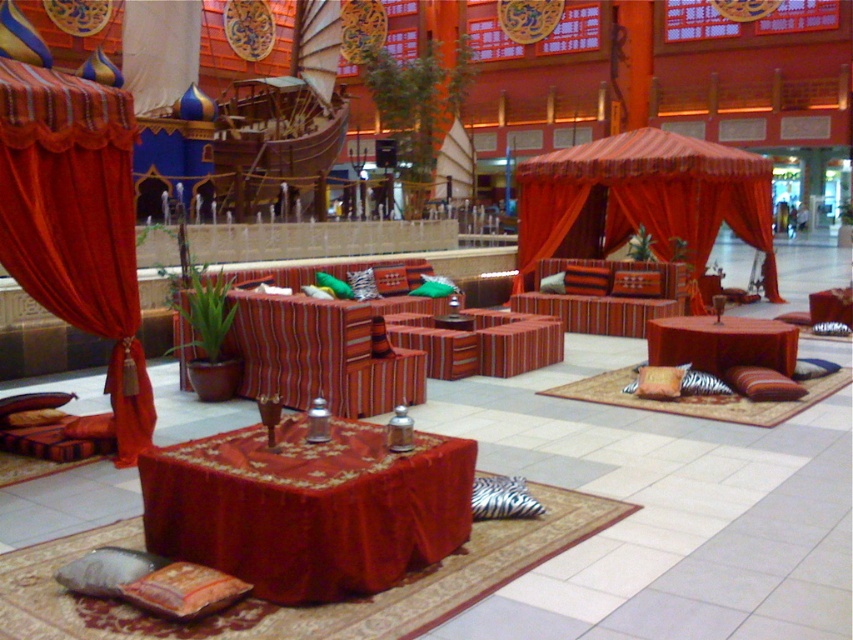
You are a customer in this mall and want to sit on the velvet red tablecloth at center. However, there is a matte red fabric canopy bed at center above it. Can you comfortably sit on the tablecloth without the canopy bed causing any discomfort?

The velvet red tablecloth at center is positioned under the matte red fabric canopy bed at center, so sitting on the tablecloth would be possible. However, the canopy bed above might restrict headspace or cause discomfort depending on its height. Since the description doesn not specify the distance between them, it is uncertain if there is enough space for comfortable sitting.